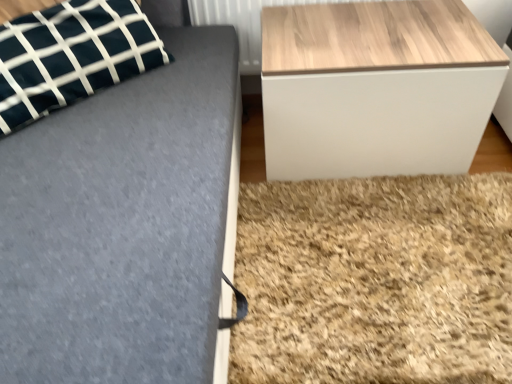
Question: From a real-world perspective, is wooden/textured table at right positioned under wooden radiator at upper right based on gravity?

Choices:
 (A) no
 (B) yes

Answer: (B)

Question: Is wooden/textured table at right in front of wooden radiator at upper right?

Choices:
 (A) yes
 (B) no

Answer: (A)

Question: Considering the relative sizes of wooden/textured table at right and wooden radiator at upper right in the image provided, is wooden/textured table at right shorter than wooden radiator at upper right?

Choices:
 (A) no
 (B) yes

Answer: (A)

Question: Is wooden/textured table at right taller than wooden radiator at upper right?

Choices:
 (A) no
 (B) yes

Answer: (B)

Question: Is wooden/textured table at right located outside wooden radiator at upper right?

Choices:
 (A) no
 (B) yes

Answer: (B)

Question: Does wooden/textured table at right lie behind wooden radiator at upper right?

Choices:
 (A) no
 (B) yes

Answer: (A)

Question: Considering the relative sizes of wooden radiator at upper right and wooden/textured table at right in the image provided, is wooden radiator at upper right bigger than wooden/textured table at right?

Choices:
 (A) no
 (B) yes

Answer: (A)

Question: From the image's perspective, is wooden radiator at upper right on wooden/textured table at right?

Choices:
 (A) yes
 (B) no

Answer: (A)

Question: Is there a large distance between wooden radiator at upper right and wooden/textured table at right?

Choices:
 (A) no
 (B) yes

Answer: (A)

Question: Considering the relative sizes of wooden radiator at upper right and wooden/textured table at right in the image provided, is wooden radiator at upper right wider than wooden/textured table at right?

Choices:
 (A) yes
 (B) no

Answer: (B)

Question: Is wooden radiator at upper right oriented away from wooden/textured table at right?

Choices:
 (A) yes
 (B) no

Answer: (A)

Question: Can you confirm if wooden radiator at upper right is positioned to the left of wooden/textured table at right?

Choices:
 (A) no
 (B) yes

Answer: (B)

Question: Would you say dark green fabric pillow at upper left is outside wooden/textured table at right?

Choices:
 (A) no
 (B) yes

Answer: (B)